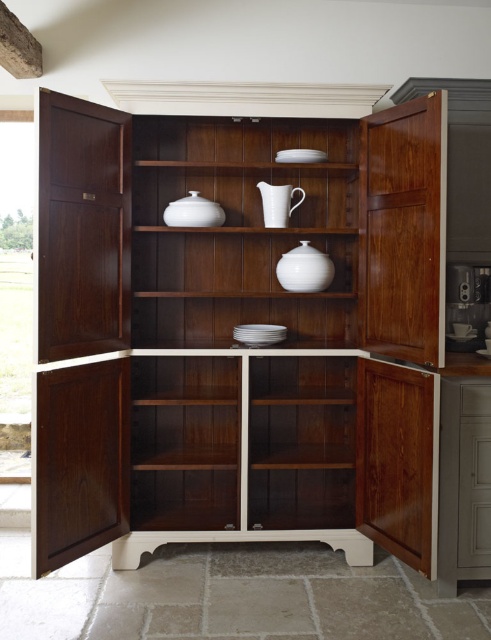
How far apart are white glossy vase at center and transparent glass door at left?

white glossy vase at center and transparent glass door at left are 18.34 feet apart from each other.

Which is more to the left, white glossy vase at center or transparent glass door at left?

From the viewer's perspective, transparent glass door at left appears more on the left side.

Does point (163, 292) lie behind point (11, 416)?

No, (163, 292) is closer to viewer.

In order to click on white glossy vase at center in this screenshot , I will do `click(230, 259)`.

From the picture: Which is below, transparent glass door at left or white glossy pitcher at center?

white glossy pitcher at center is below.

Which of these two, transparent glass door at left or white glossy pitcher at center, stands shorter?

white glossy pitcher at center

Between point (22, 148) and point (334, 182), which one is positioned in front?

Positioned in front is point (334, 182).

The height and width of the screenshot is (640, 491). I want to click on transparent glass door at left, so click(16, 294).

Looking at this image, which is more to the left, white glossy pitcher at center or white ceramic pitcher at center?

Positioned to the left is white glossy pitcher at center.

Who is taller, white glossy pitcher at center or white ceramic pitcher at center?

Standing taller between the two is white glossy pitcher at center.

I want to click on white glossy pitcher at center, so click(255, 192).

This screenshot has width=491, height=640. Find the location of `white glossy pitcher at center`. white glossy pitcher at center is located at coordinates (255, 192).